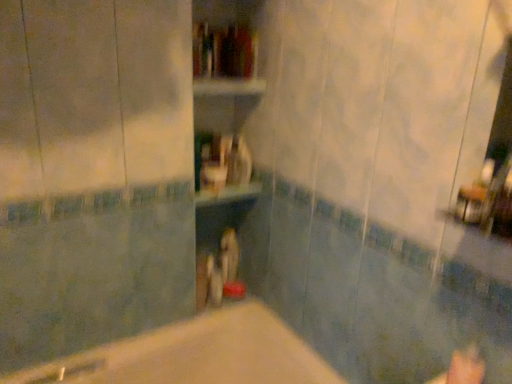
Image resolution: width=512 pixels, height=384 pixels. Find the location of `free point above beige matte bathtub at center (from a real-world perspective)`. free point above beige matte bathtub at center (from a real-world perspective) is located at coordinates (212, 357).